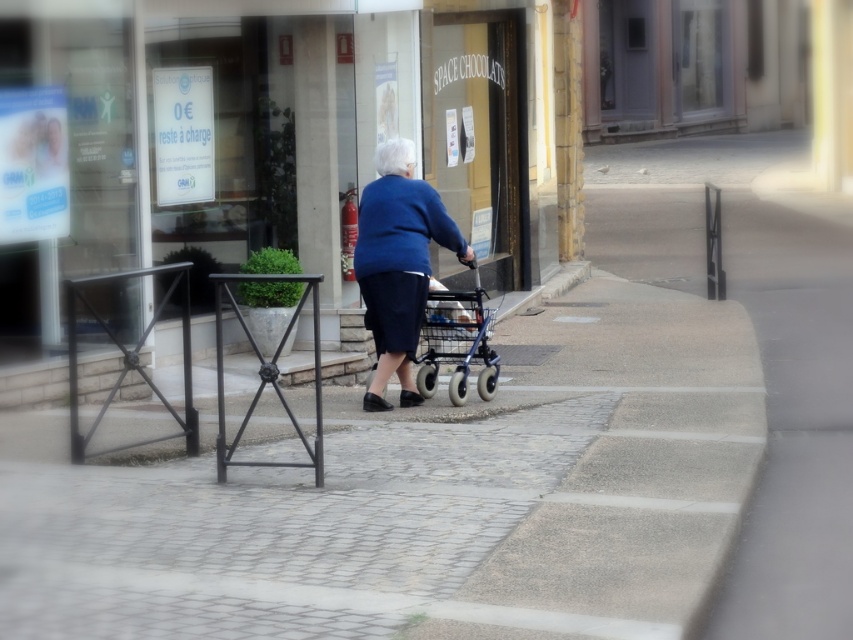
Question: Which of the following is the closest to the observer?

Choices:
 (A) (573, 557)
 (B) (413, 333)
 (C) (428, 304)

Answer: (A)

Question: Can you confirm if gray concrete pavement at center is thinner than metallic blue walker at center?

Choices:
 (A) yes
 (B) no

Answer: (B)

Question: Observing the image, what is the correct spatial positioning of gray concrete pavement at center in reference to blue fabric walker at center?

Choices:
 (A) below
 (B) above

Answer: (A)

Question: Which of the following is the farthest from the observer?

Choices:
 (A) metallic blue walker at center
 (B) blue fabric walker at center

Answer: (A)

Question: Can you confirm if gray concrete pavement at center is smaller than metallic blue walker at center?

Choices:
 (A) yes
 (B) no

Answer: (B)

Question: Which point is farther to the camera?

Choices:
 (A) pyautogui.click(x=573, y=589)
 (B) pyautogui.click(x=479, y=348)
 (C) pyautogui.click(x=401, y=193)

Answer: (B)